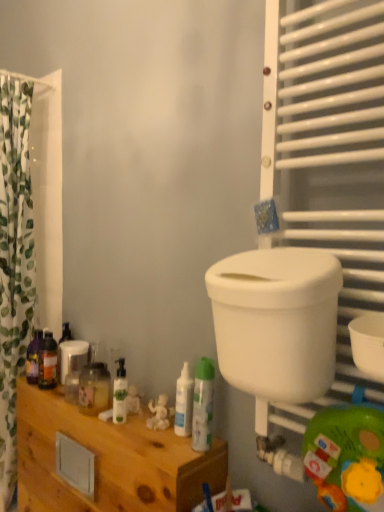
The width and height of the screenshot is (384, 512). What are the coordinates of `vacant area that lies between white glossy spray can at center, arranged as the 5th toiletry when viewed from the back, and white glossy pump bottle at center, the 3th toiletry viewed from the right` in the screenshot? It's located at (157, 433).